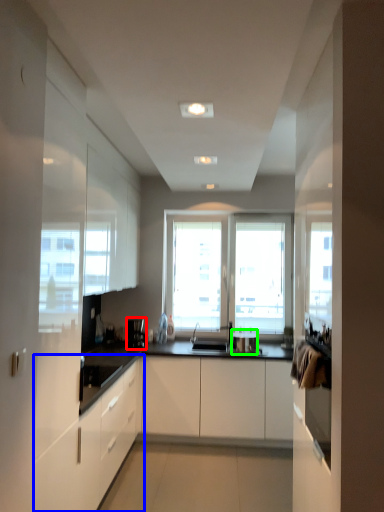
Question: Estimate the real-world distances between objects in this image. Which object is closer to coffee machine (highlighted by a red box), cabinetry (highlighted by a blue box) or appliance (highlighted by a green box)?

Choices:
 (A) cabinetry
 (B) appliance

Answer: (B)